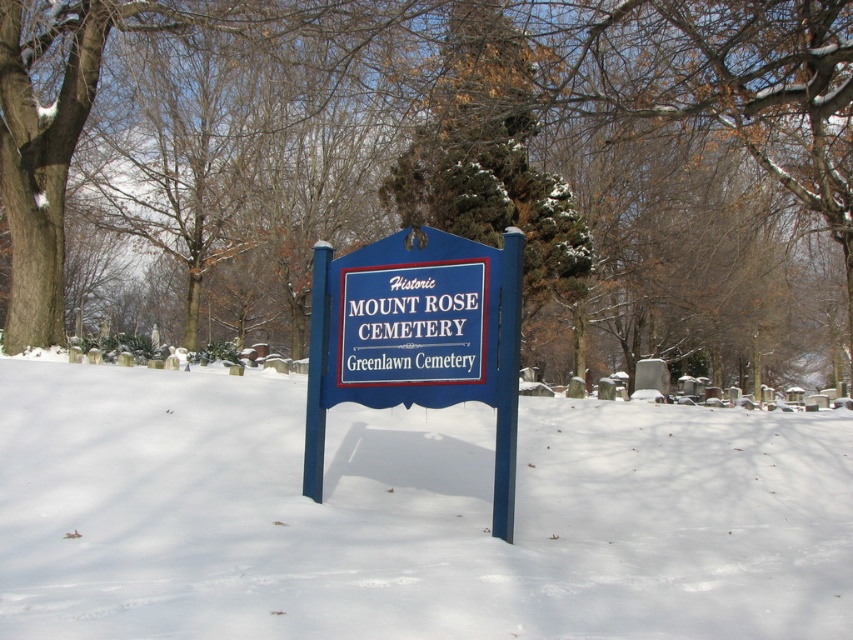
You are a visitor at Mount Rose Cemetery and want to take a photo of both the green textured evergreen at center and the blue painted wood sign at center. Which object will appear bigger in your photo?

The green textured evergreen at center will appear bigger in the photo because it has a larger size compared to the blue painted wood sign at center.

You are a visitor at Mount Rose Cemetery and want to take a photo of the blue painted wood sign at center. However, you notice that the white powdery snow at center might be in the way. Is the snow taller or shorter than the sign?

The white powdery snow at center is shorter than the blue painted wood sign at center, so the snow won not block the view of the sign.

You are a visitor at the cemetery and want to take a photo of the blue painted wood sign at center without any obstructions. Is the white powdery snow at center blocking your view of the sign?

The white powdery snow at center is in front of the blue painted wood sign at center, so it is blocking the view of the sign. You would need to move the snow or adjust your position to capture an unobstructed photo of the blue painted wood sign at center.